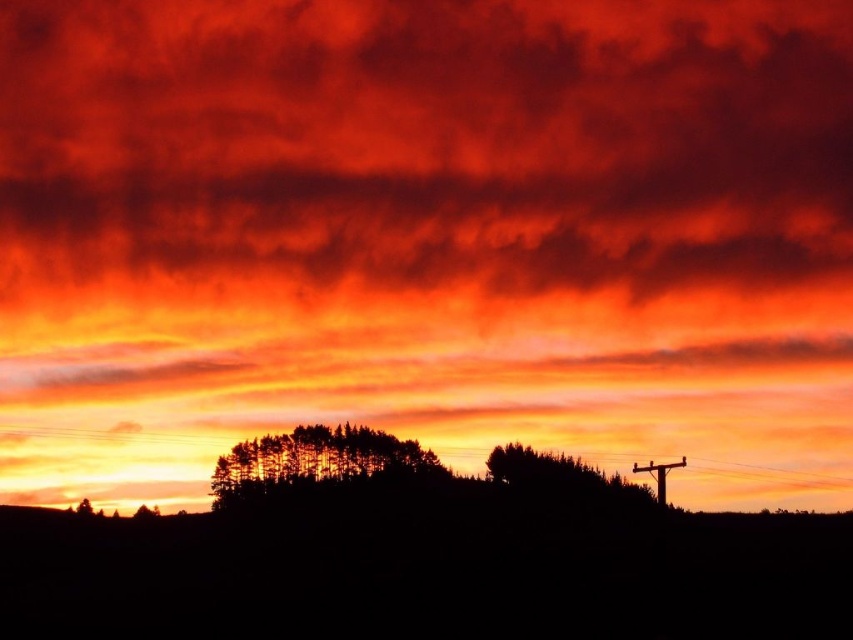
Does metallic wire at center lie behind silhouette wooden telegraph pole at right?

Yes, it is behind silhouette wooden telegraph pole at right.

Does point (212, 435) lie behind point (671, 461)?

Yes, point (212, 435) is behind point (671, 461).

This screenshot has width=853, height=640. Identify the location of metallic wire at center. (111, 435).

Does point (306, 468) lie behind point (83, 429)?

No.

Between silhouette tree at center and metallic wire at center, which one appears on the left side from the viewer's perspective?

silhouette tree at center

Which is behind, point (300, 428) or point (721, 465)?

The point (721, 465) is more distant.

Identify the location of silhouette tree at center. Image resolution: width=853 pixels, height=640 pixels. (314, 460).

Is silhouette tree at center below silhouette wooden telegraph pole at right?

Indeed, silhouette tree at center is positioned under silhouette wooden telegraph pole at right.

Locate an element on the screen. silhouette tree at center is located at coordinates (314, 460).

Measure the distance between silhouette tree at center and camera.

They are 305.65 feet apart.

Where is `silhouette tree at center`? silhouette tree at center is located at coordinates [314, 460].